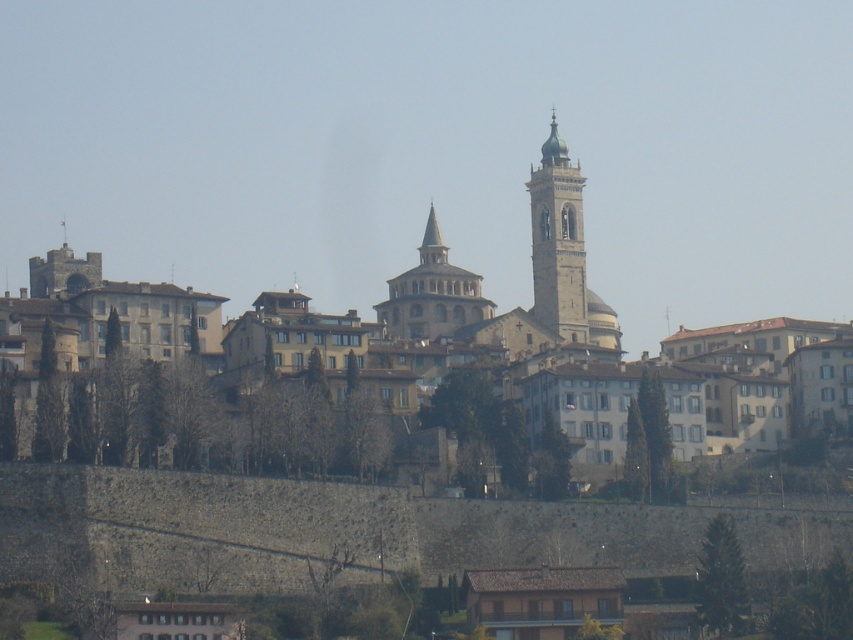
Is beige stone town at center taller than beige stone tower at center?

Yes, beige stone town at center is taller than beige stone tower at center.

Does beige stone town at center appear on the right side of beige stone tower at center?

In fact, beige stone town at center is to the left of beige stone tower at center.

Does point (306, 314) come behind point (544, 273)?

No, (306, 314) is in front of (544, 273).

Find the location of a particular element. beige stone town at center is located at coordinates (532, 278).

Is point (547, 280) positioned after point (399, 292)?

Yes, point (547, 280) is behind point (399, 292).

Between beige stone tower at center and light brown stone tower at center, which one is positioned higher?

Positioned higher is light brown stone tower at center.

What do you see at coordinates (563, 252) in the screenshot?
I see `beige stone tower at center` at bounding box center [563, 252].

Find the location of `beige stone tower at center`. beige stone tower at center is located at coordinates (563, 252).

Does beige stone town at center appear under light brown stone tower at center?

Yes, beige stone town at center is below light brown stone tower at center.

Between beige stone town at center and light brown stone tower at center, which one has more height?

beige stone town at center is taller.

Who is more distant from viewer, (531, 195) or (434, 298)?

The point (531, 195) is more distant.

Where is `beige stone town at center`? The height and width of the screenshot is (640, 853). beige stone town at center is located at coordinates (532, 278).